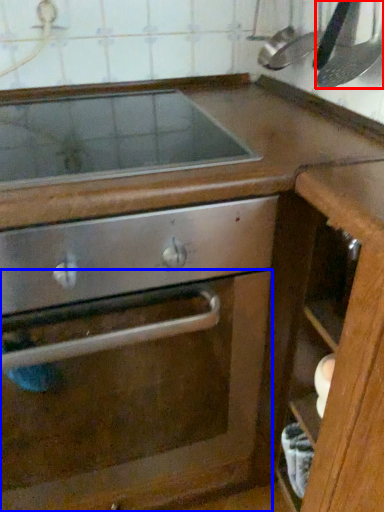
Question: Among these objects, which one is nearest to the camera, kitchen appliance (highlighted by a red box) or glass door (highlighted by a blue box)?

Choices:
 (A) kitchen appliance
 (B) glass door

Answer: (B)